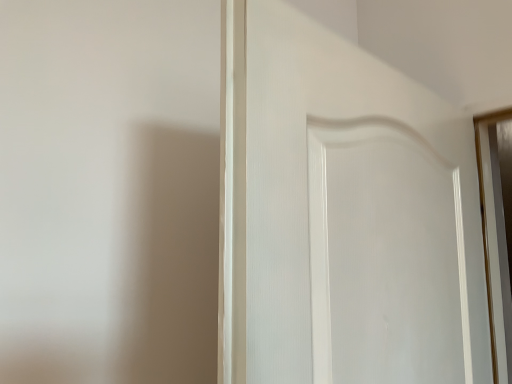
Measure the distance between point (277, 186) and camera.

21.73 inches.

The height and width of the screenshot is (384, 512). What do you see at coordinates (312, 184) in the screenshot? I see `white glossy door at center` at bounding box center [312, 184].

Find the location of `white glossy door at center`. white glossy door at center is located at coordinates (312, 184).

Identify the location of white glossy door at center. This screenshot has width=512, height=384. (312, 184).